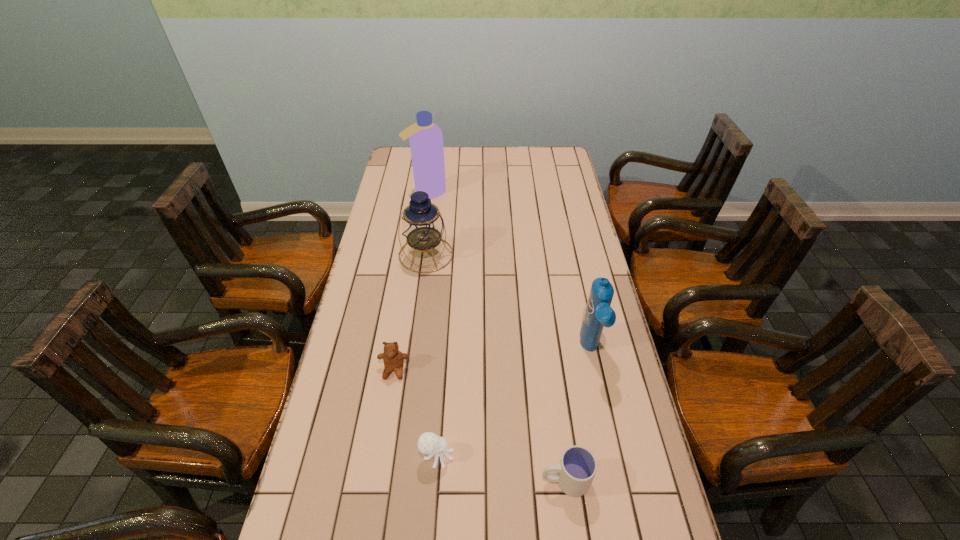
Locate an element on the screen. The image size is (960, 540). the tallest object is located at coordinates (426, 139).

Image resolution: width=960 pixels, height=540 pixels. I want to click on the left shampoo, so click(426, 139).

Find the location of a particular element. The width and height of the screenshot is (960, 540). lantern is located at coordinates (422, 225).

Locate an element on the screen. This screenshot has height=540, width=960. the right shampoo is located at coordinates (598, 314).

This screenshot has width=960, height=540. In order to click on the rightmost object in this screenshot , I will do `click(598, 314)`.

Identify the location of teddy bear. Image resolution: width=960 pixels, height=540 pixels. (393, 359).

In order to click on cup in this screenshot , I will do `click(574, 474)`.

Where is `octopus`? This screenshot has height=540, width=960. octopus is located at coordinates (428, 443).

Identify the location of blank space located on the back of the farthest object. The height and width of the screenshot is (540, 960). (431, 166).

Identify the location of vacant space located on the front-facing side of the lantern. The height and width of the screenshot is (540, 960). (421, 288).